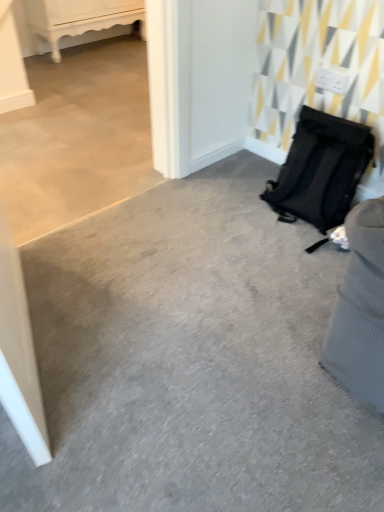
This screenshot has width=384, height=512. What do you see at coordinates (321, 170) in the screenshot? I see `matte black backpack at right` at bounding box center [321, 170].

In order to face black fabric backpack at right, should I rotate leftwards or rightwards?

You should look right and rotate roughly 5.064 degrees.

The width and height of the screenshot is (384, 512). What are the coordinates of `matte black backpack at right` in the screenshot? It's located at (321, 170).

How much distance is there between white glossy cabinet at upper left and matte black backpack at right?

white glossy cabinet at upper left and matte black backpack at right are 7.75 feet apart from each other.

Between white glossy cabinet at upper left and matte black backpack at right, which one has more height?

white glossy cabinet at upper left is taller.

Would you say matte black backpack at right is part of white glossy cabinet at upper left's contents?

No.

This screenshot has width=384, height=512. I want to click on concrete on the left side of matte black backpack at right, so click(x=190, y=360).

Is point (224, 177) in front of point (312, 116)?

No, (224, 177) is behind (312, 116).

Choose the correct answer: Is black fabric backpack at right inside matte black backpack at right or outside it?

black fabric backpack at right is located beyond the bounds of matte black backpack at right.

Which object is wider, black fabric backpack at right or matte black backpack at right?

black fabric backpack at right.

Is matte black backpack at right to the left or to the right of black fabric backpack at right in the image?

Clearly, matte black backpack at right is on the right of black fabric backpack at right in the image.

Which is correct: matte black backpack at right is inside black fabric backpack at right, or outside of it?

matte black backpack at right is not inside black fabric backpack at right, it's outside.

From the picture: Is matte black backpack at right bigger or smaller than black fabric backpack at right?

In the image, matte black backpack at right appears to be smaller than black fabric backpack at right.

Is matte black backpack at right taller or shorter than black fabric backpack at right?

matte black backpack at right is taller than black fabric backpack at right.

Would you say black fabric backpack at right is a long distance from white glossy cabinet at upper left?

Yes, black fabric backpack at right and white glossy cabinet at upper left are quite far apart.

From a real-world perspective, is black fabric backpack at right positioned over white glossy cabinet at upper left based on gravity?

No, from a real-world perspective, black fabric backpack at right is not above white glossy cabinet at upper left.

What's the angular difference between black fabric backpack at right and white glossy cabinet at upper left's facing directions?

There is a 90-degree angle between the facing directions of black fabric backpack at right and white glossy cabinet at upper left.

Which is more distant, (x=132, y=9) or (x=57, y=432)?

The point (x=132, y=9) is farther from the camera.

In the scene shown: From the image's perspective, between white glossy cabinet at upper left and black fabric backpack at right, which one is located above?

white glossy cabinet at upper left.

Is white glossy cabinet at upper left taller or shorter than black fabric backpack at right?

Clearly, white glossy cabinet at upper left is taller compared to black fabric backpack at right.

Considering the positions of objects white glossy cabinet at upper left and black fabric backpack at right in the image provided, who is in front, white glossy cabinet at upper left or black fabric backpack at right?

Positioned in front is black fabric backpack at right.

Is the surface of matte black backpack at right in direct contact with white glossy cabinet at upper left?

matte black backpack at right and white glossy cabinet at upper left are not in contact.

From a real-world perspective, which is physically above, matte black backpack at right or white glossy cabinet at upper left?

white glossy cabinet at upper left, from a real-world perspective.

Locate an element on the screen. The image size is (384, 512). furniture lying above the matte black backpack at right (from the image's perspective) is located at coordinates (80, 18).

Considering the relative sizes of matte black backpack at right and white glossy cabinet at upper left in the image provided, is matte black backpack at right shorter than white glossy cabinet at upper left?

Yes, matte black backpack at right is shorter than white glossy cabinet at upper left.

This screenshot has width=384, height=512. Identify the location of furniture above the matte black backpack at right (from a real-world perspective). (80, 18).

The width and height of the screenshot is (384, 512). What are the coordinates of `concrete that appears in front of the matte black backpack at right` in the screenshot? It's located at (190, 360).

When comparing their distances from matte black backpack at right, does black fabric backpack at right or white glossy cabinet at upper left seem closer?

Among the two, black fabric backpack at right is located nearer to matte black backpack at right.

When comparing their distances from black fabric backpack at right, does white glossy cabinet at upper left or matte black backpack at right seem closer?

matte black backpack at right.

From the image, which object appears to be nearer to white glossy cabinet at upper left, black fabric backpack at right or matte black backpack at right?

matte black backpack at right is positioned closer to the anchor white glossy cabinet at upper left.

Which object lies further to the anchor point black fabric backpack at right, matte black backpack at right or white glossy cabinet at upper left?

white glossy cabinet at upper left.

Based on their spatial positions, is matte black backpack at right or black fabric backpack at right closer to white glossy cabinet at upper left?

Based on the image, matte black backpack at right appears to be nearer to white glossy cabinet at upper left.

When comparing their distances from matte black backpack at right, does white glossy cabinet at upper left or black fabric backpack at right seem further?

white glossy cabinet at upper left is positioned further to the anchor matte black backpack at right.

Identify the location of luggage and bags between black fabric backpack at right and white glossy cabinet at upper left in the front-back direction. This screenshot has height=512, width=384. (321, 170).